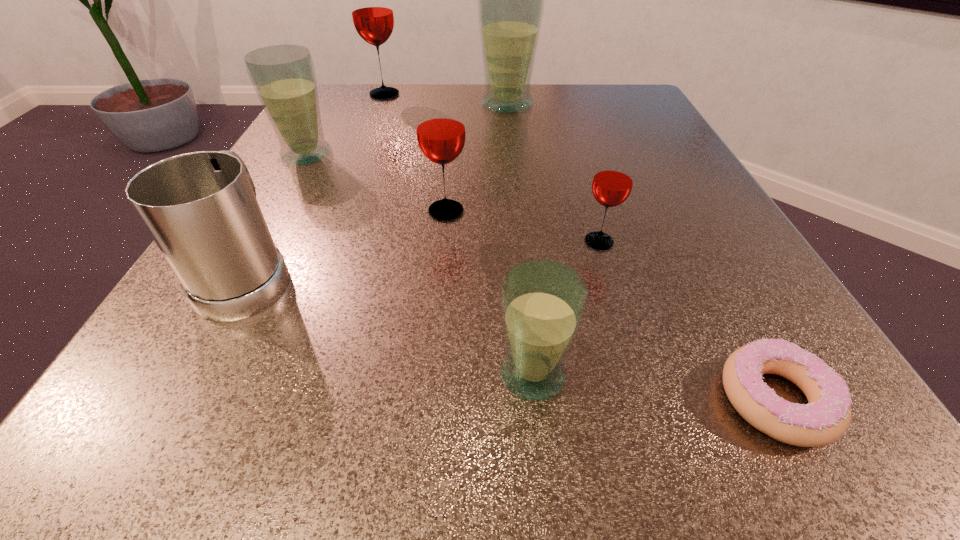
Identify the location of the closest red glass to the nearest blue glass. (612, 184).

Find the location of a particular element. Image resolution: width=960 pixels, height=540 pixels. red glass that is the second closest to the smallest blue glass is located at coordinates (440, 126).

The height and width of the screenshot is (540, 960). I want to click on blue glass that is the closest to the gray mug, so click(283, 76).

Locate an element on the screen. The image size is (960, 540). blue glass that is the second nearest to the second biggest blue glass is located at coordinates (543, 302).

Where is `free spot that satisfies the following two spatial constraints: 1. on the front side of the pink doughnut; 2. on the left side of the nearest blue glass`? The width and height of the screenshot is (960, 540). free spot that satisfies the following two spatial constraints: 1. on the front side of the pink doughnut; 2. on the left side of the nearest blue glass is located at coordinates (536, 400).